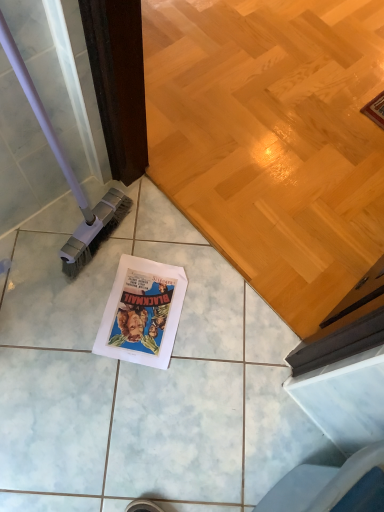
Image resolution: width=384 pixels, height=512 pixels. Identify the location of vacant space behind white paper comic book at center. (159, 237).